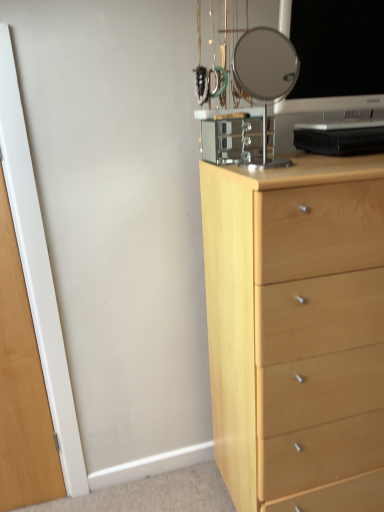
Question: Is clear glass mirror at upper center to the right of transparent glass door at left from the viewer's perspective?

Choices:
 (A) yes
 (B) no

Answer: (A)

Question: Is the position of clear glass mirror at upper center more distant than that of transparent glass door at left?

Choices:
 (A) no
 (B) yes

Answer: (A)

Question: Does clear glass mirror at upper center have a greater width compared to transparent glass door at left?

Choices:
 (A) no
 (B) yes

Answer: (B)

Question: Does clear glass mirror at upper center have a greater height compared to transparent glass door at left?

Choices:
 (A) no
 (B) yes

Answer: (A)

Question: Is clear glass mirror at upper center thinner than transparent glass door at left?

Choices:
 (A) yes
 (B) no

Answer: (B)

Question: Can you confirm if clear glass mirror at upper center is shorter than transparent glass door at left?

Choices:
 (A) yes
 (B) no

Answer: (A)

Question: From the image's perspective, is black glossy computer monitor at upper right located beneath transparent glass door at left?

Choices:
 (A) no
 (B) yes

Answer: (A)

Question: From the image's perspective, is black glossy computer monitor at upper right above transparent glass door at left?

Choices:
 (A) yes
 (B) no

Answer: (A)

Question: Is black glossy computer monitor at upper right taller than transparent glass door at left?

Choices:
 (A) yes
 (B) no

Answer: (B)

Question: Does black glossy computer monitor at upper right have a lesser width compared to transparent glass door at left?

Choices:
 (A) yes
 (B) no

Answer: (B)

Question: Is black glossy computer monitor at upper right oriented away from transparent glass door at left?

Choices:
 (A) yes
 (B) no

Answer: (B)

Question: Considering the relative positions of black glossy computer monitor at upper right and transparent glass door at left in the image provided, is black glossy computer monitor at upper right to the left of transparent glass door at left from the viewer's perspective?

Choices:
 (A) no
 (B) yes

Answer: (A)

Question: Can you confirm if black glossy computer monitor at upper right is taller than light wood chest of drawers at right?

Choices:
 (A) no
 (B) yes

Answer: (A)